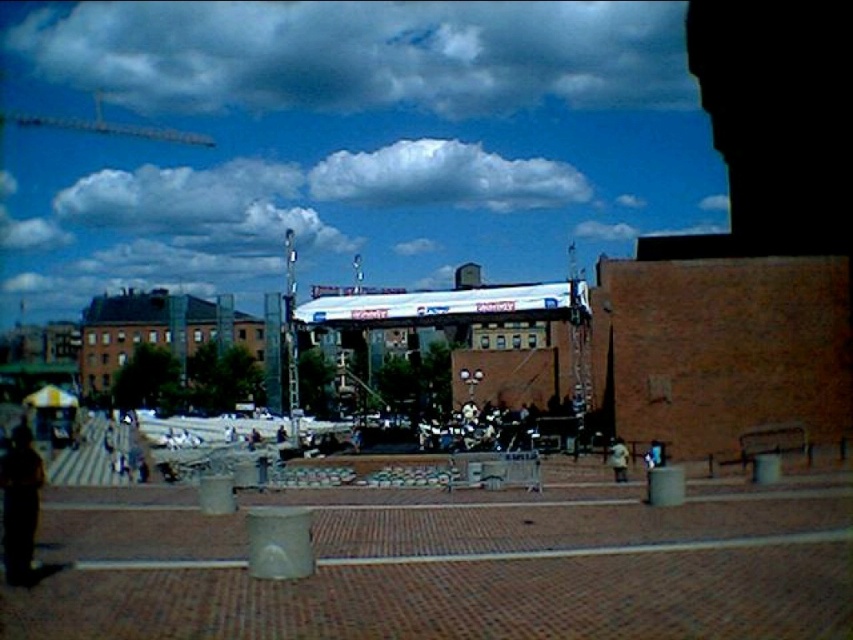
Does point (15, 580) come in front of point (614, 456)?

Yes.

Who is more distant from viewer, [30,472] or [613,440]?

Positioned behind is point [613,440].

Locate an element on the screen. dark brown leather jacket at lower left is located at coordinates (20, 504).

Is concrete at center bigger than light brown leather jacket at lower right?

Correct, concrete at center is larger in size than light brown leather jacket at lower right.

Which is behind, point (74, 621) or point (618, 449)?

Positioned behind is point (618, 449).

The height and width of the screenshot is (640, 853). What are the coordinates of `concrete at center` in the screenshot? It's located at (448, 564).

Is concrete at center to the right of dark brown leather jacket at lower left from the viewer's perspective?

Correct, you'll find concrete at center to the right of dark brown leather jacket at lower left.

This screenshot has height=640, width=853. Identify the location of concrete at center. (448, 564).